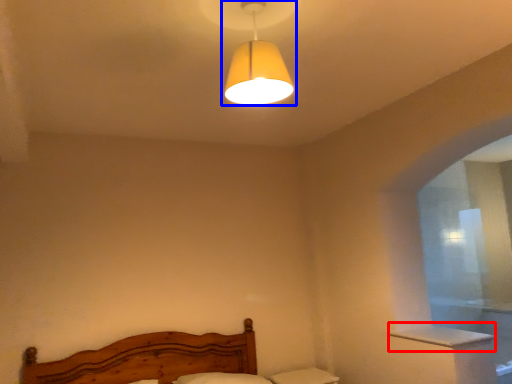
Question: Which object is further to the camera taking this photo, window sill (highlighted by a red box) or lamp (highlighted by a blue box)?

Choices:
 (A) window sill
 (B) lamp

Answer: (A)